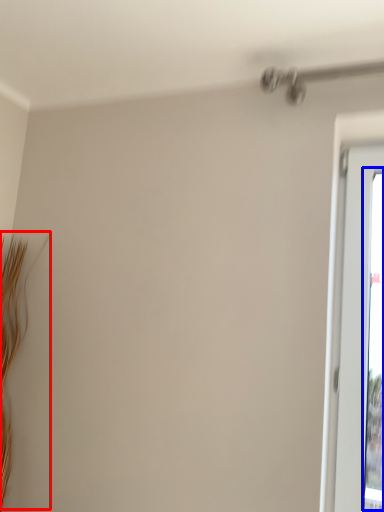
Question: Among these objects, which one is nearest to the camera, twig (highlighted by a red box) or window screen (highlighted by a blue box)?

Choices:
 (A) twig
 (B) window screen

Answer: (B)